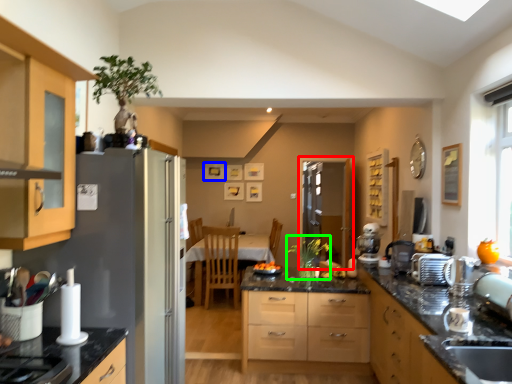
Question: Which object is positioned farthest from screen door (highlighted by a red box)? Select from picture frame (highlighted by a blue box) and plant (highlighted by a green box).

Choices:
 (A) picture frame
 (B) plant

Answer: (B)